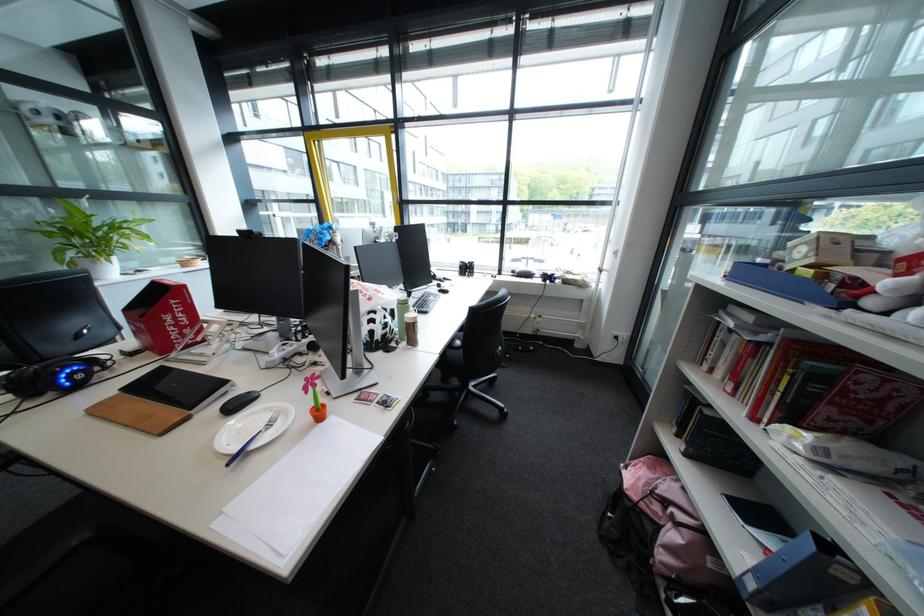
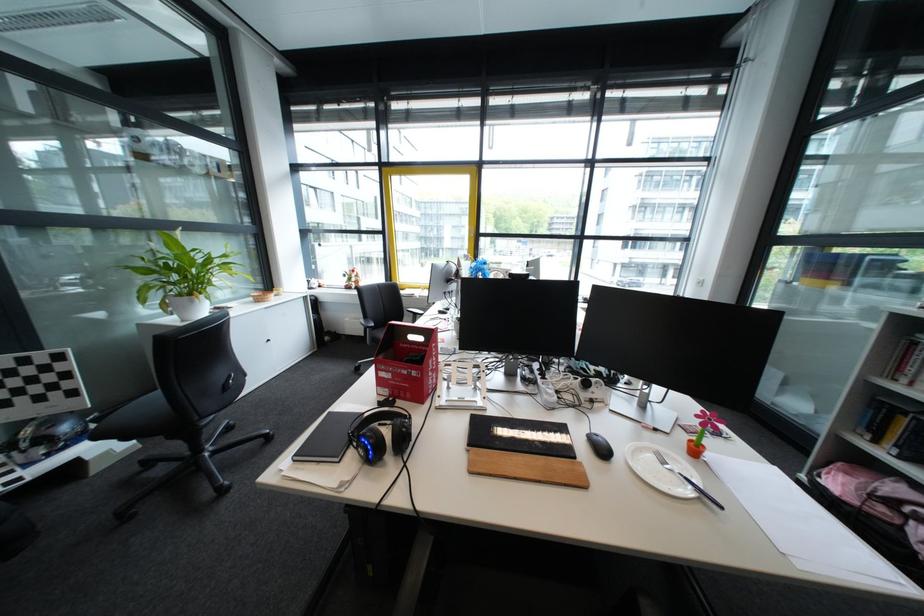
Question: The images are taken continuously from a first-person perspective. In which direction are you moving?

Choices:
 (A) Left
 (B) Right
 (C) Forward
 (D) Backward

Answer: (A)